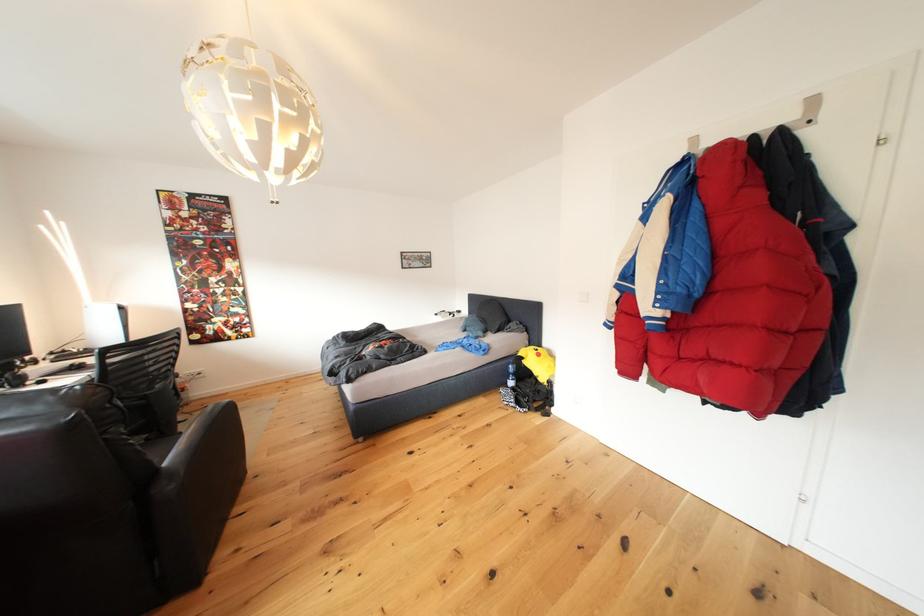
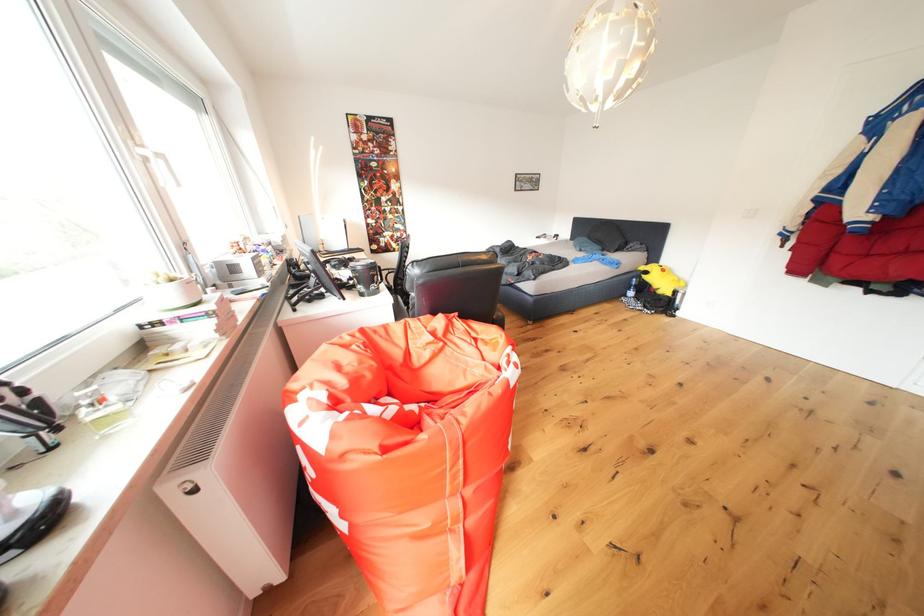
The point at (507,369) is marked in the first image. Where is the corresponding point in the second image?

(634, 282)